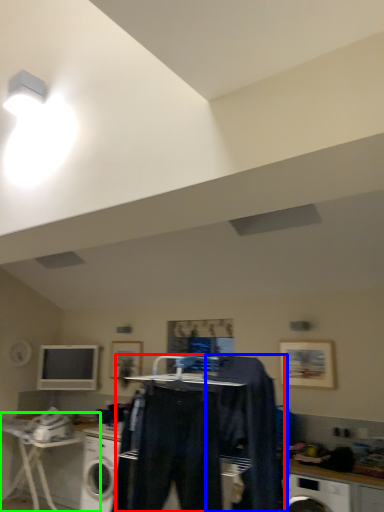
Question: Which object is positioned farthest from clothing (highlighted by a red box)? Select from clothing (highlighted by a blue box) and table (highlighted by a green box).

Choices:
 (A) clothing
 (B) table

Answer: (B)